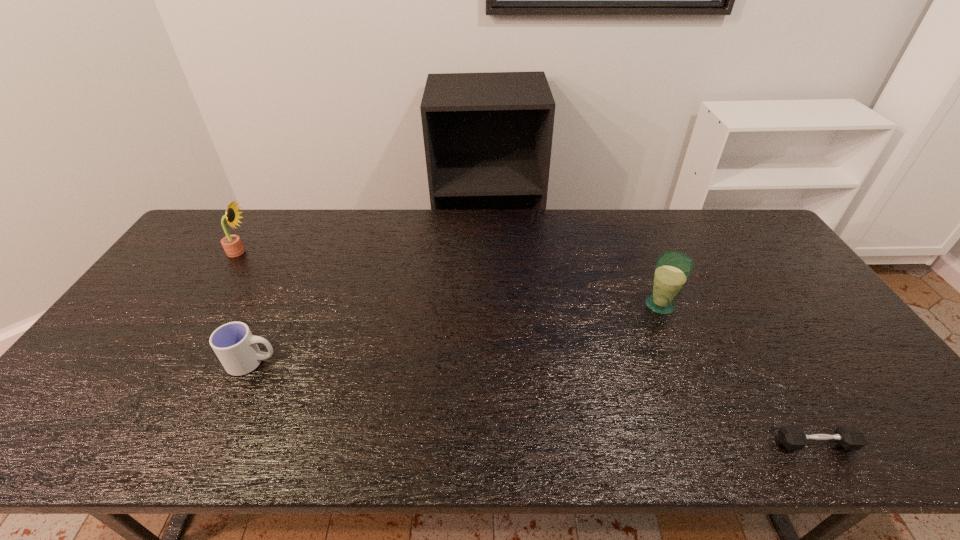
What are the coordinates of `vacant space situated with the handle on the side of the cup` in the screenshot? It's located at (426, 362).

Identify the location of free space located on the left of the rightmost object. This screenshot has height=540, width=960. tap(627, 443).

Identify the location of object that is at the far edge. The height and width of the screenshot is (540, 960). (233, 247).

This screenshot has width=960, height=540. In order to click on object that is positioned at the near edge in this screenshot , I will do `click(791, 437)`.

The image size is (960, 540). What are the coordinates of `object that is at the left edge` in the screenshot? It's located at (233, 247).

You are a GUI agent. You are given a task and a screenshot of the screen. Output one action in this format:
    pyautogui.click(x=<x>, y=<y>)
    Task: Click on the object that is at the far left corner
    
    Given the screenshot: What is the action you would take?
    pyautogui.click(x=233, y=247)

Where is `vacant space at the far edge`? This screenshot has width=960, height=540. vacant space at the far edge is located at coordinates (397, 217).

The image size is (960, 540). Find the location of `free spot at the near edge of the desktop`. free spot at the near edge of the desktop is located at coordinates (279, 442).

Where is `free spot at the left edge of the desktop`? The height and width of the screenshot is (540, 960). free spot at the left edge of the desktop is located at coordinates (124, 381).

The height and width of the screenshot is (540, 960). Find the location of `vacant position at the right edge of the desktop`. vacant position at the right edge of the desktop is located at coordinates (774, 313).